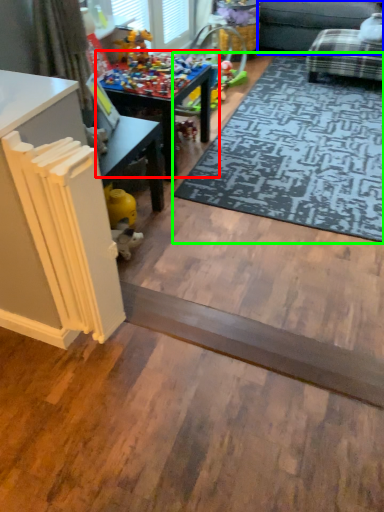
Question: Which object is the farthest from table (highlighted by a red box)? Choose among these: couch (highlighted by a blue box) or mat (highlighted by a green box).

Choices:
 (A) couch
 (B) mat

Answer: (A)